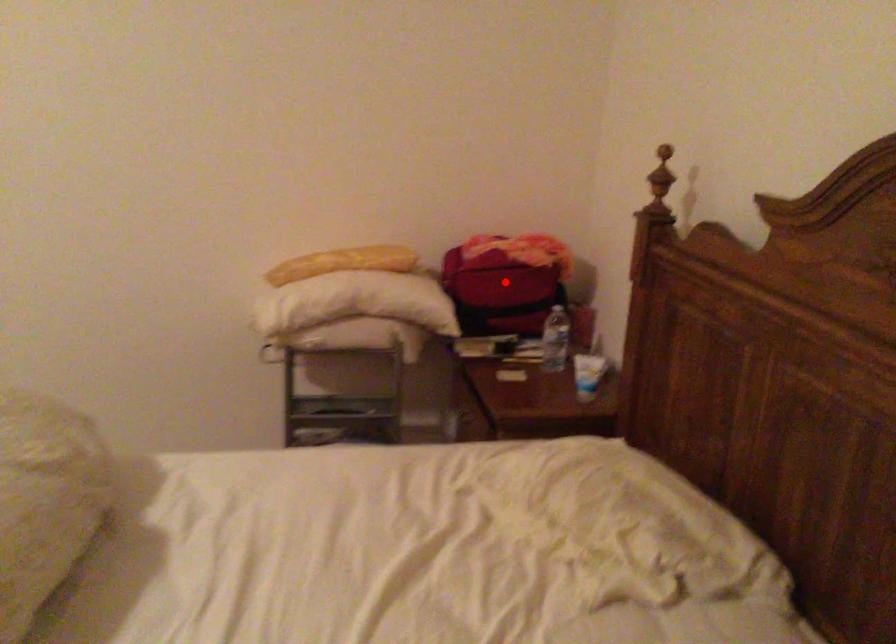
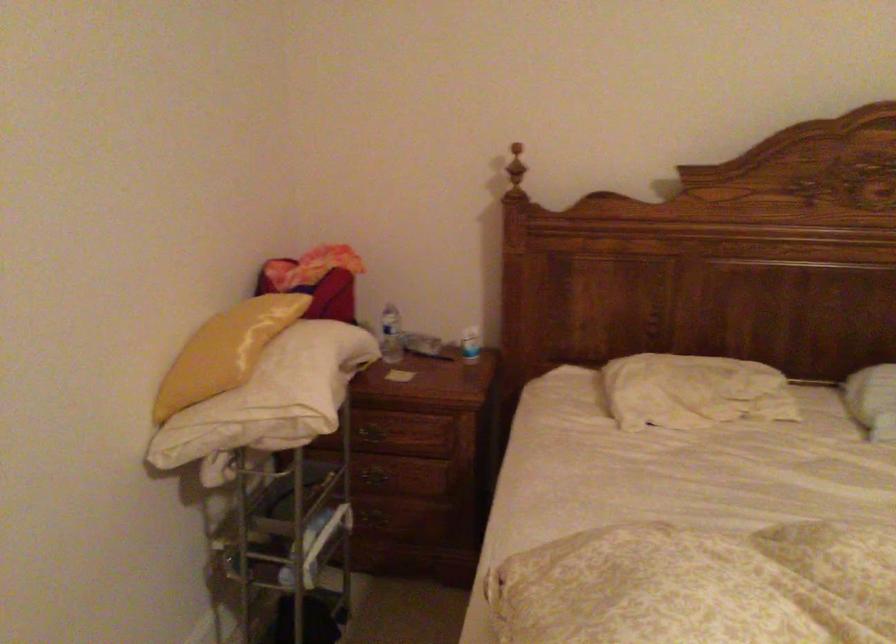
Question: I am providing you with two images of the same scene from different viewpoints. A red point is marked on the first image. At the location where the point appears in image 1, is it still visible in image 2?

Choices:
 (A) Yes
 (B) No

Answer: (B)